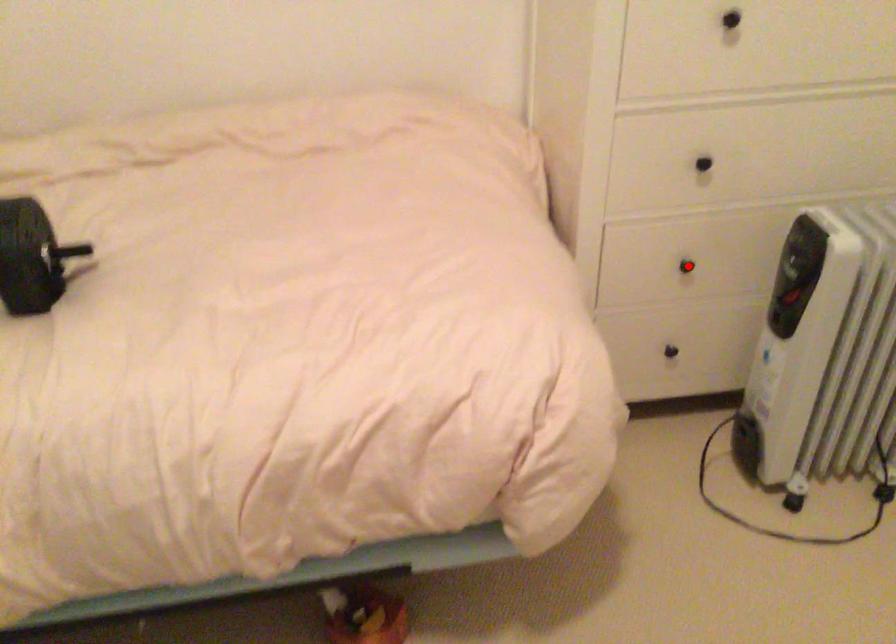
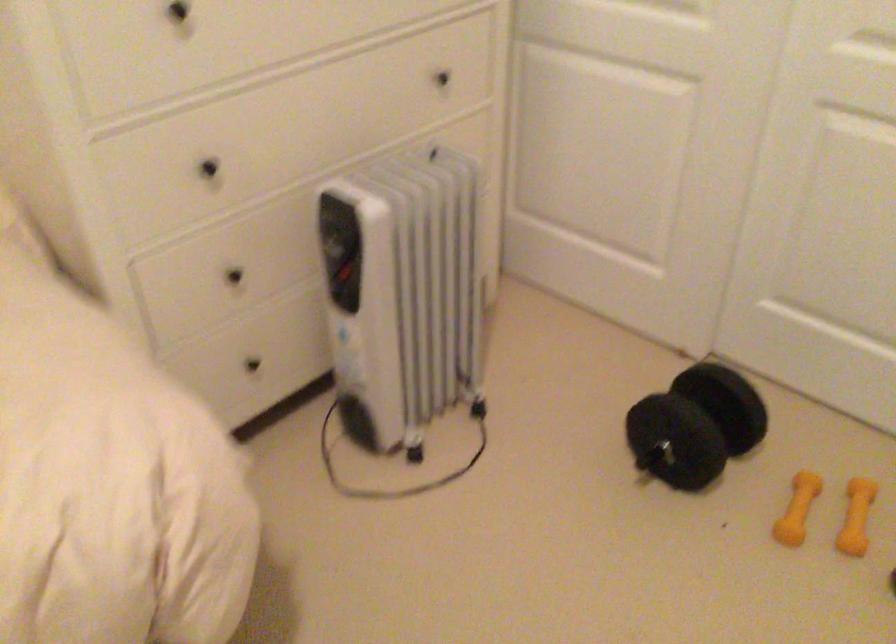
Where in the second image is the point corresponding to the highlighted location from the first image?

(234, 276)